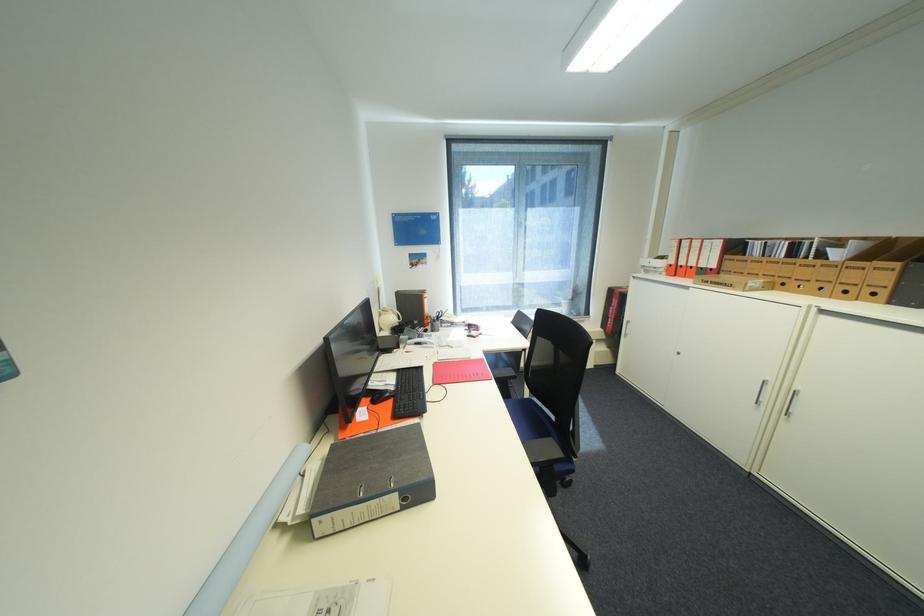
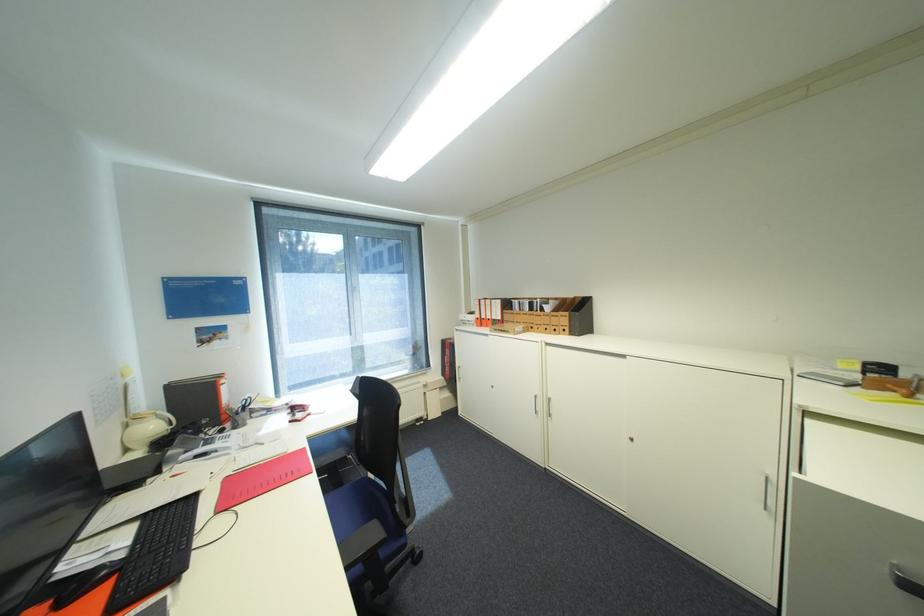
The point at (678, 265) is marked in the first image. Where is the corresponding point in the second image?

(485, 318)